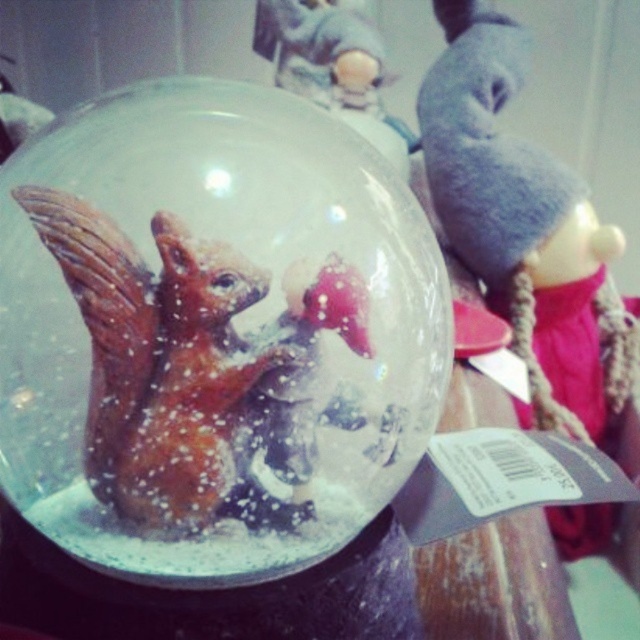
Which is more to the right, transparent glass globe at center or shiny brown squirrel at center?

transparent glass globe at center

Can you confirm if transparent glass globe at center is positioned above shiny brown squirrel at center?

Indeed, transparent glass globe at center is positioned over shiny brown squirrel at center.

Which is behind, point (365, 349) or point (182, 371)?

The point (365, 349) is more distant.

This screenshot has width=640, height=640. In order to click on transparent glass globe at center in this screenshot , I will do `click(212, 332)`.